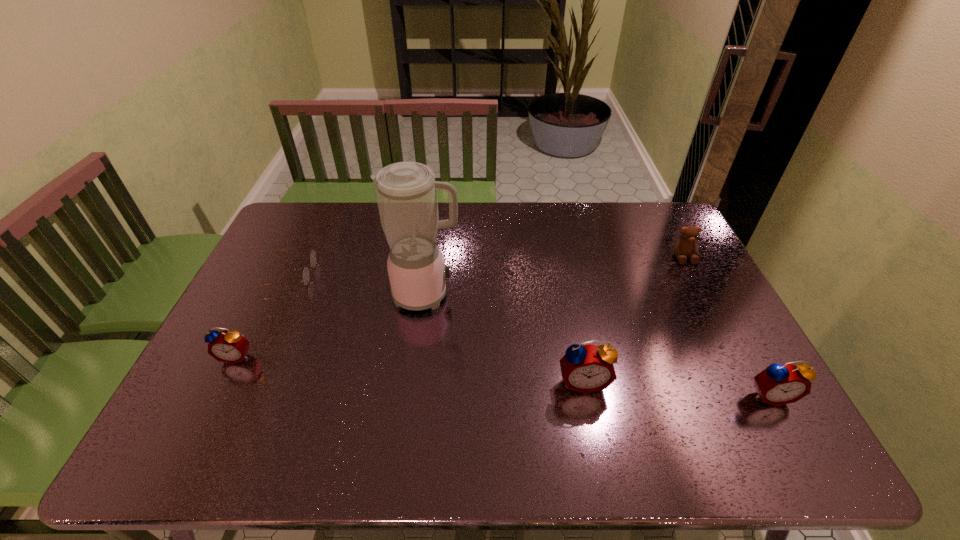
This screenshot has width=960, height=540. In order to click on the leftmost alarm clock in this screenshot , I will do `click(231, 347)`.

What are the coordinates of `the fourth farthest object` in the screenshot? It's located at point(231,347).

Find the location of a particular element. The height and width of the screenshot is (540, 960). the third object from right to left is located at coordinates (588, 368).

The height and width of the screenshot is (540, 960). Identify the location of the second shortest alarm clock. (778, 384).

Find the location of a particular element. the rightmost alarm clock is located at coordinates (778, 384).

At what (x,y) coordinates should I click in order to perform the action: click on the third object from left to right. Please return your answer as a coordinate pair (x, y). Looking at the image, I should click on (406, 192).

At what (x,y) coordinates should I click in order to perform the action: click on the tallest object. Please return your answer as a coordinate pair (x, y). This screenshot has width=960, height=540. Looking at the image, I should click on (406, 192).

What are the coordinates of `teddy bear` in the screenshot? It's located at (686, 245).

Locate an element on the screen. spectacles is located at coordinates (313, 257).

I want to click on blank space located on the front-facing side of the leftmost alarm clock, so click(219, 391).